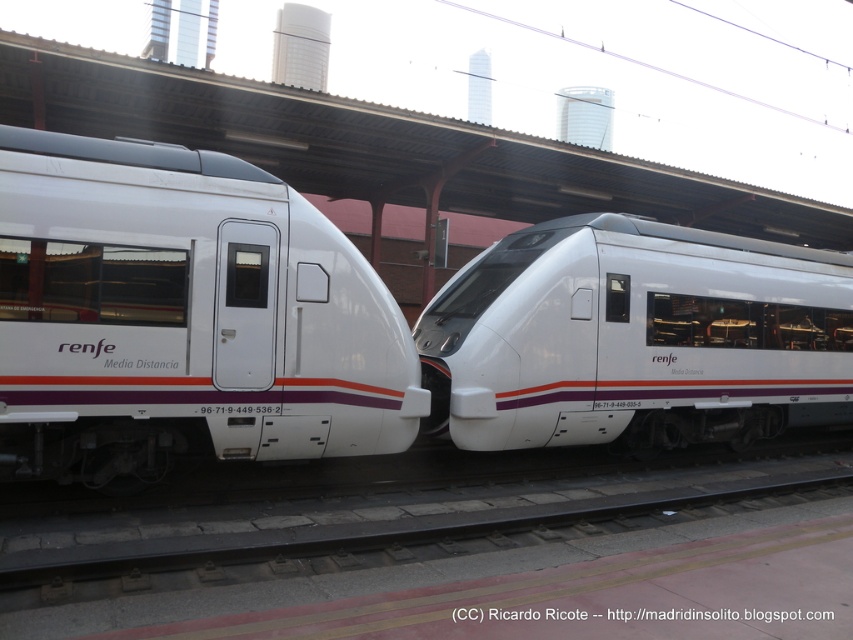
Question: Is white glossy train at left to the left of white glossy train at center from the viewer's perspective?

Choices:
 (A) yes
 (B) no

Answer: (A)

Question: Can you confirm if white glossy train at left is thinner than white glossy train at center?

Choices:
 (A) yes
 (B) no

Answer: (A)

Question: Considering the relative positions of white glossy train at left and white glossy train at center in the image provided, where is white glossy train at left located with respect to white glossy train at center?

Choices:
 (A) right
 (B) left

Answer: (B)

Question: Which point appears farthest from the camera in this image?

Choices:
 (A) (311, 346)
 (B) (776, 294)

Answer: (B)